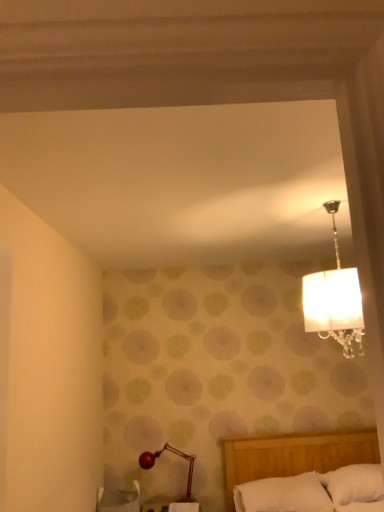
Image resolution: width=384 pixels, height=512 pixels. Describe the element at coordinates (283, 495) in the screenshot. I see `white soft pillow at lower center, which is the 2th pillow from right to left` at that location.

The width and height of the screenshot is (384, 512). What do you see at coordinates (177, 455) in the screenshot? I see `shiny red lamp at lower left` at bounding box center [177, 455].

The width and height of the screenshot is (384, 512). I want to click on white soft pillow at lower right, marked as the second pillow in a left-to-right arrangement, so click(354, 483).

Find the location of `white soft pillow at lower center, which is the 2th pillow from right to left`. white soft pillow at lower center, which is the 2th pillow from right to left is located at coordinates (283, 495).

Is white soft pillow at lower center, which is the 2th pillow from right to left, not near shiny red lamp at lower left?

No, white soft pillow at lower center, which is the 2th pillow from right to left, is not far from shiny red lamp at lower left.

Which object is positioned more to the left, white soft pillow at lower center, which is the 2th pillow from right to left, or shiny red lamp at lower left?

Positioned to the left is shiny red lamp at lower left.

Which object is thinner, white soft pillow at lower center, which is the 2th pillow from right to left, or shiny red lamp at lower left?

Thinner between the two is shiny red lamp at lower left.

Which pillow is the 1st one when counting from the right side of the shiny red lamp at lower left? Please provide its 2D coordinates.

[(283, 495)]

Does white soft pillow at lower right, arranged as the 1th pillow when viewed from the right, have a lesser height compared to white soft pillow at lower center, the 1th pillow viewed from the left?

No, white soft pillow at lower right, arranged as the 1th pillow when viewed from the right, is not shorter than white soft pillow at lower center, the 1th pillow viewed from the left.

Is white soft pillow at lower right, arranged as the 1th pillow when viewed from the right, outside of white soft pillow at lower center, the 1th pillow viewed from the left?

Yes, white soft pillow at lower right, arranged as the 1th pillow when viewed from the right, is outside of white soft pillow at lower center, the 1th pillow viewed from the left.

Is white soft pillow at lower right, marked as the second pillow in a left-to-right arrangement, beside white soft pillow at lower center, the 1th pillow viewed from the left?

No, white soft pillow at lower right, marked as the second pillow in a left-to-right arrangement, is not making contact with white soft pillow at lower center, the 1th pillow viewed from the left.

From the image's perspective, relative to white soft pillow at lower right, arranged as the 1th pillow when viewed from the right, is white soft pillow at lower center, which is the 2th pillow from right to left, above or below?

Based on their image positions, white soft pillow at lower center, which is the 2th pillow from right to left, is located beneath white soft pillow at lower right, arranged as the 1th pillow when viewed from the right.

From the picture: Is white soft pillow at lower center, the 1th pillow viewed from the left, taller or shorter than white soft pillow at lower right, arranged as the 1th pillow when viewed from the right?

Considering their sizes, white soft pillow at lower center, the 1th pillow viewed from the left, has less height than white soft pillow at lower right, arranged as the 1th pillow when viewed from the right.

From a real-world perspective, relative to white soft pillow at lower right, arranged as the 1th pillow when viewed from the right, is white soft pillow at lower center, the 1th pillow viewed from the left, vertically above or below?

white soft pillow at lower center, the 1th pillow viewed from the left, is below white soft pillow at lower right, arranged as the 1th pillow when viewed from the right.

Is white soft pillow at lower center, which is the 2th pillow from right to left, next to white soft pillow at lower right, marked as the second pillow in a left-to-right arrangement, and touching it?

There is a gap between white soft pillow at lower center, which is the 2th pillow from right to left, and white soft pillow at lower right, marked as the second pillow in a left-to-right arrangement.

Is point (336, 490) more distant than point (104, 490)?

No, it is not.

How far apart are white soft pillow at lower right, arranged as the 1th pillow when viewed from the right, and white woven basket at lower left?

They are 5.22 feet apart.

Considering the sizes of objects white soft pillow at lower right, marked as the second pillow in a left-to-right arrangement, and white woven basket at lower left in the image provided, who is wider, white soft pillow at lower right, marked as the second pillow in a left-to-right arrangement, or white woven basket at lower left?

Wider between the two is white woven basket at lower left.

Does white soft pillow at lower right, arranged as the 1th pillow when viewed from the right, touch white woven basket at lower left?

No, white soft pillow at lower right, arranged as the 1th pillow when viewed from the right, is not making contact with white woven basket at lower left.

Which object is positioned more to the right, shiny red lamp at lower left or white soft pillow at lower right, arranged as the 1th pillow when viewed from the right?

From the viewer's perspective, white soft pillow at lower right, arranged as the 1th pillow when viewed from the right, appears more on the right side.

Could you measure the distance between shiny red lamp at lower left and white soft pillow at lower right, marked as the second pillow in a left-to-right arrangement?

shiny red lamp at lower left is 1.20 meters from white soft pillow at lower right, marked as the second pillow in a left-to-right arrangement.

Who is bigger, shiny red lamp at lower left or white soft pillow at lower right, arranged as the 1th pillow when viewed from the right?

Bigger between the two is white soft pillow at lower right, arranged as the 1th pillow when viewed from the right.

Considering the relative sizes of shiny red lamp at lower left and white soft pillow at lower right, arranged as the 1th pillow when viewed from the right, in the image provided, is shiny red lamp at lower left shorter than white soft pillow at lower right, arranged as the 1th pillow when viewed from the right,?

In fact, shiny red lamp at lower left may be taller than white soft pillow at lower right, arranged as the 1th pillow when viewed from the right.

Considering the relative sizes of shiny red lamp at lower left and white woven basket at lower left in the image provided, is shiny red lamp at lower left bigger than white woven basket at lower left?

Incorrect, shiny red lamp at lower left is not larger than white woven basket at lower left.

Which point is more forward, (175, 448) or (120, 496)?

The point (120, 496) is in front.

Where is `furniture lying on the left of shiny red lamp at lower left`? The image size is (384, 512). furniture lying on the left of shiny red lamp at lower left is located at coordinates (119, 500).

Is shiny red lamp at lower left far away from white woven basket at lower left?

They are positioned close to each other.

Is point (130, 496) closer or farther from the camera than point (187, 493)?

Point (130, 496).

Which of these two, white woven basket at lower left or shiny red lamp at lower left, stands taller?

Standing taller between the two is shiny red lamp at lower left.

Which of these two, white woven basket at lower left or shiny red lamp at lower left, is bigger?

white woven basket at lower left is bigger.

From the image's perspective, would you say white woven basket at lower left is positioned over shiny red lamp at lower left?

No.

What are the coordinates of `lamp on the left of white soft pillow at lower center, which is the 2th pillow from right to left` in the screenshot? It's located at (177, 455).

Identify the location of pillow above the white soft pillow at lower center, the 1th pillow viewed from the left (from the image's perspective). (354, 483).

Consider the image. Based on their spatial positions, is white soft pillow at lower center, which is the 2th pillow from right to left, or white soft pillow at lower right, arranged as the 1th pillow when viewed from the right, closer to white woven basket at lower left?

white soft pillow at lower center, which is the 2th pillow from right to left, is positioned closer to the anchor white woven basket at lower left.

When comparing their distances from white woven basket at lower left, does white soft pillow at lower center, which is the 2th pillow from right to left, or shiny red lamp at lower left seem closer?

The object closer to white woven basket at lower left is shiny red lamp at lower left.

When comparing their distances from shiny red lamp at lower left, does white woven basket at lower left or white soft pillow at lower right, arranged as the 1th pillow when viewed from the right, seem closer?

white woven basket at lower left lies closer to shiny red lamp at lower left than the other object.

Estimate the real-world distances between objects in this image. Which object is further from white woven basket at lower left, shiny red lamp at lower left or white soft pillow at lower center, the 1th pillow viewed from the left?

Based on the image, white soft pillow at lower center, the 1th pillow viewed from the left, appears to be further to white woven basket at lower left.

Considering their positions, is white woven basket at lower left positioned further to white soft pillow at lower center, the 1th pillow viewed from the left, than white soft pillow at lower right, arranged as the 1th pillow when viewed from the right?

white woven basket at lower left.

Based on their spatial positions, is white soft pillow at lower center, which is the 2th pillow from right to left, or shiny red lamp at lower left further from white soft pillow at lower right, arranged as the 1th pillow when viewed from the right?

shiny red lamp at lower left lies further to white soft pillow at lower right, arranged as the 1th pillow when viewed from the right, than the other object.

Which object lies nearer to the anchor point white soft pillow at lower right, marked as the second pillow in a left-to-right arrangement, shiny red lamp at lower left or white soft pillow at lower center, which is the 2th pillow from right to left?

Among the two, white soft pillow at lower center, which is the 2th pillow from right to left, is located nearer to white soft pillow at lower right, marked as the second pillow in a left-to-right arrangement.

Estimate the real-world distances between objects in this image. Which object is further from white soft pillow at lower right, marked as the second pillow in a left-to-right arrangement, shiny red lamp at lower left or white woven basket at lower left?

Among the two, white woven basket at lower left is located further to white soft pillow at lower right, marked as the second pillow in a left-to-right arrangement.

I want to click on lamp situated between white woven basket at lower left and white soft pillow at lower center, the 1th pillow viewed from the left, from left to right, so click(x=177, y=455).

The image size is (384, 512). Identify the location of pillow situated between shiny red lamp at lower left and white soft pillow at lower right, arranged as the 1th pillow when viewed from the right, from left to right. (283, 495).

Where is `pillow between white woven basket at lower left and white soft pillow at lower right, arranged as the 1th pillow when viewed from the right, from left to right`? This screenshot has width=384, height=512. pillow between white woven basket at lower left and white soft pillow at lower right, arranged as the 1th pillow when viewed from the right, from left to right is located at coordinates (283, 495).

Locate an element on the screen. lamp situated between white woven basket at lower left and white soft pillow at lower right, marked as the second pillow in a left-to-right arrangement, from left to right is located at coordinates (177, 455).